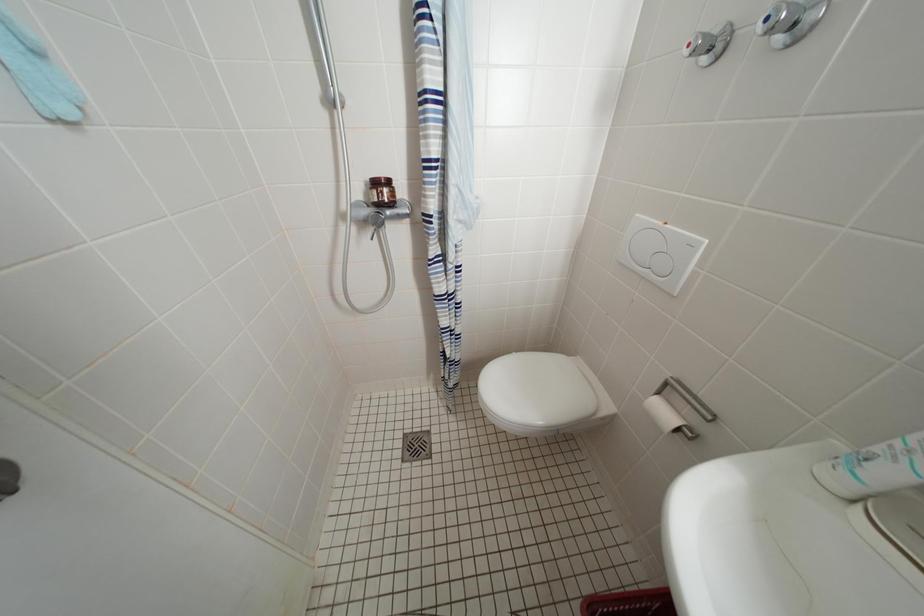
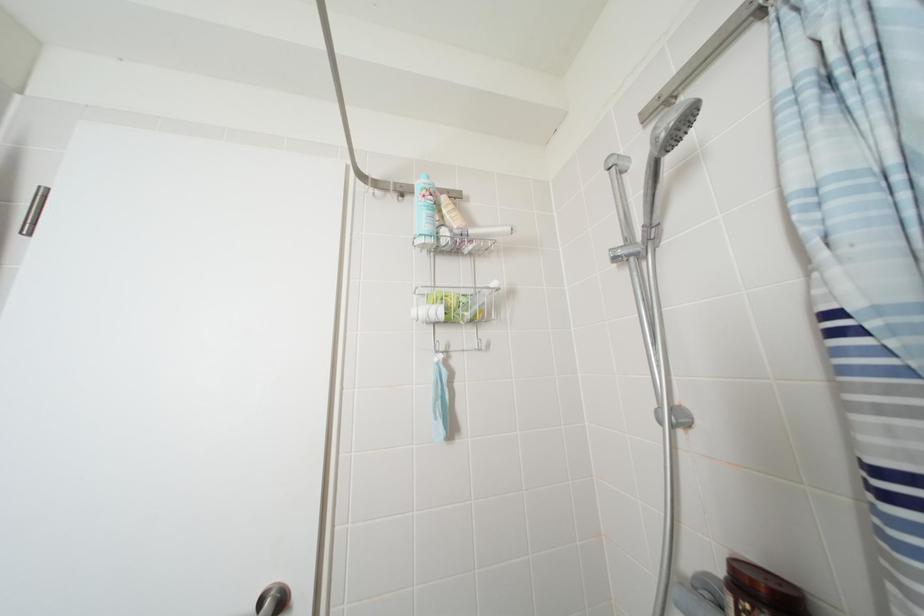
Question: The camera is either moving clockwise (left) or counter-clockwise (right) around the object. The first image is from the beginning of the video and the second image is from the end. Is the camera moving left or right when shooting the video?

Choices:
 (A) Left
 (B) Right

Answer: (B)